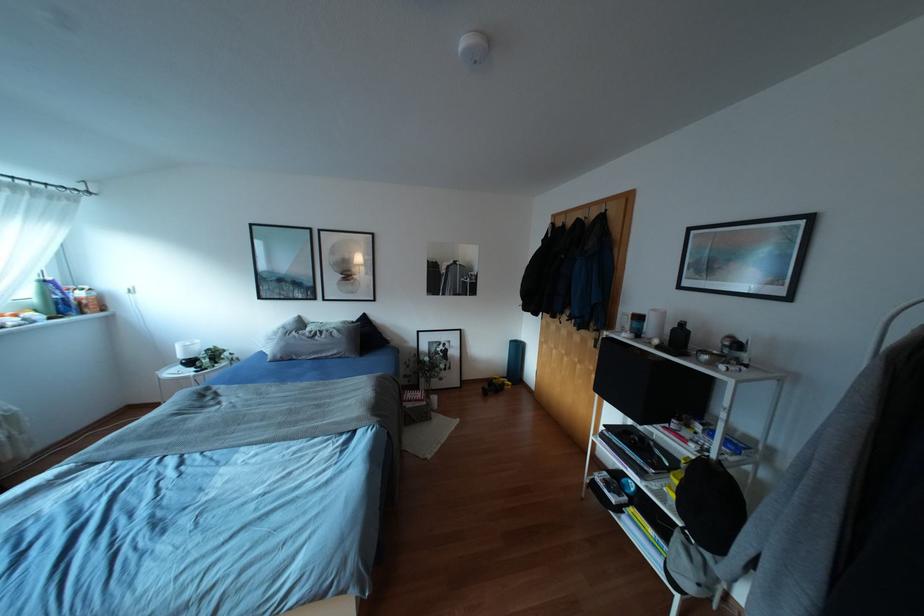
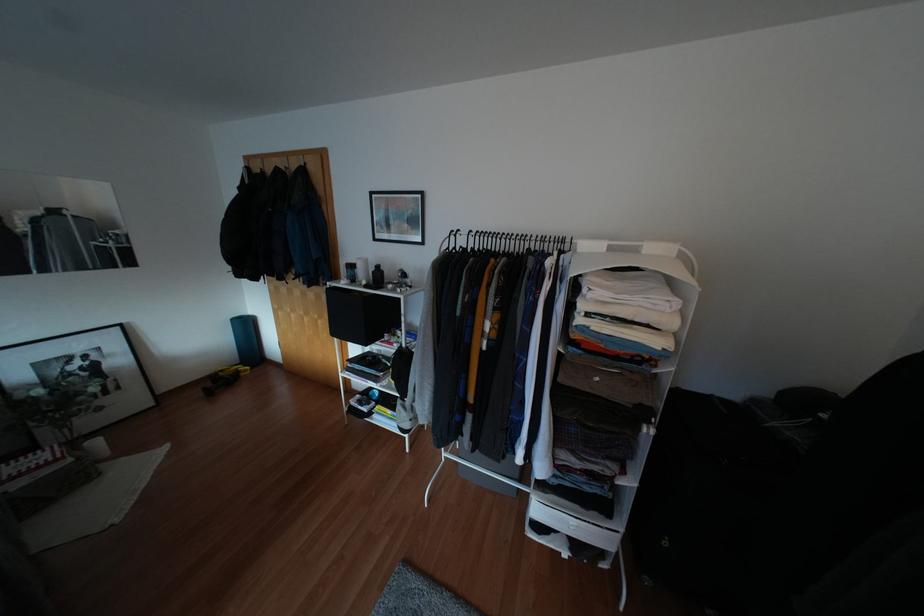
The point at (517, 347) is marked in the first image. Where is the corresponding point in the second image?

(246, 325)